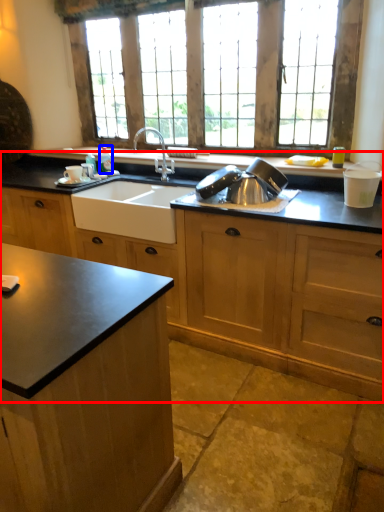
Question: Among these objects, which one is nearest to the camera, cabinetry (highlighted by a red box) or bottle (highlighted by a blue box)?

Choices:
 (A) cabinetry
 (B) bottle

Answer: (A)